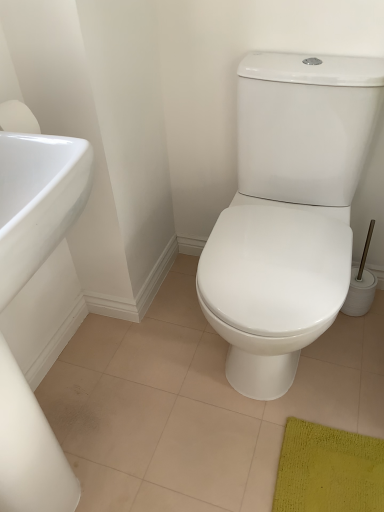
Question: Is white glossy toilet at center situated inside white glossy sink at left or outside?

Choices:
 (A) inside
 (B) outside

Answer: (B)

Question: From the image's perspective, is white glossy toilet at center located above or below white glossy sink at left?

Choices:
 (A) below
 (B) above

Answer: (B)

Question: Is white glossy toilet at center bigger or smaller than white glossy sink at left?

Choices:
 (A) big
 (B) small

Answer: (A)

Question: Considering the positions of white glossy sink at left and white glossy toilet at center in the image, is white glossy sink at left bigger or smaller than white glossy toilet at center?

Choices:
 (A) small
 (B) big

Answer: (A)

Question: Is white glossy sink at left to the left or to the right of white glossy toilet at center in the image?

Choices:
 (A) right
 (B) left

Answer: (B)

Question: In terms of width, does white glossy sink at left look wider or thinner when compared to white glossy toilet at center?

Choices:
 (A) thin
 (B) wide

Answer: (A)

Question: Relative to white glossy toilet at center, is white glossy sink at left in front or behind?

Choices:
 (A) behind
 (B) front

Answer: (B)